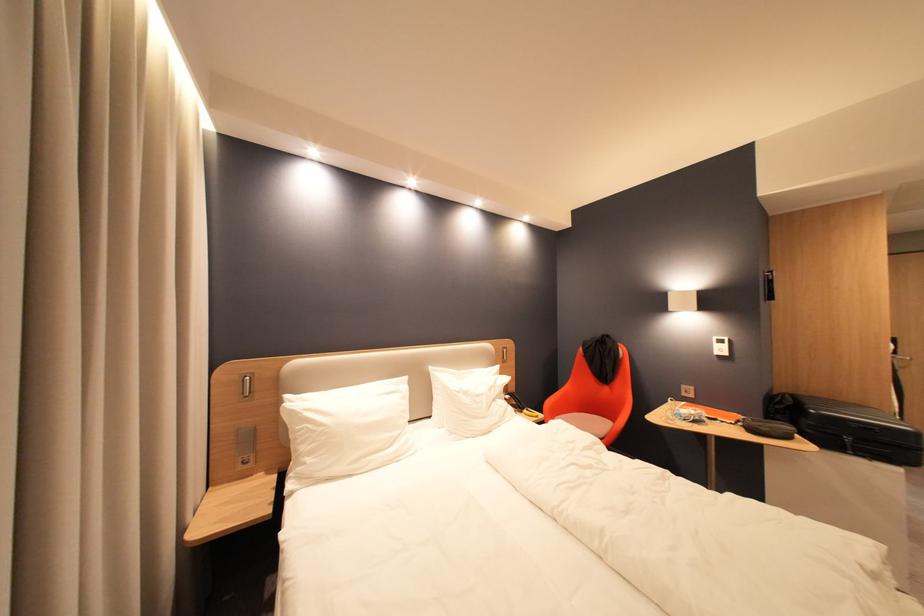
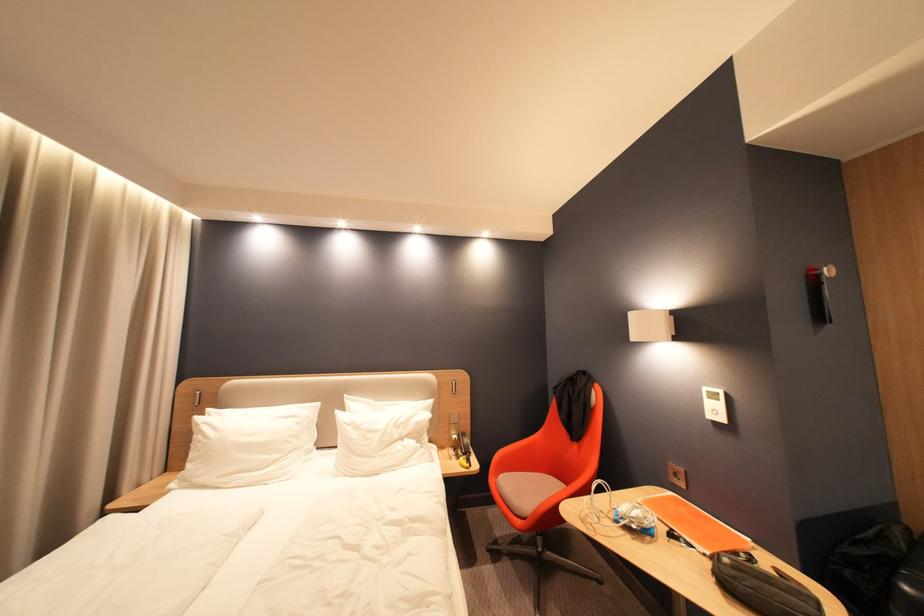
Where in the second image is the point corresponding to (x=731, y=351) from the first image?

(724, 413)